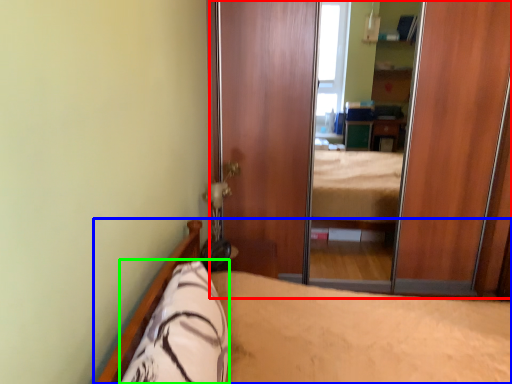
Question: Considering the real-world distances, which object is farthest from screen door (highlighted by a red box)? bed (highlighted by a blue box) or pillow (highlighted by a green box)?

Choices:
 (A) bed
 (B) pillow

Answer: (B)